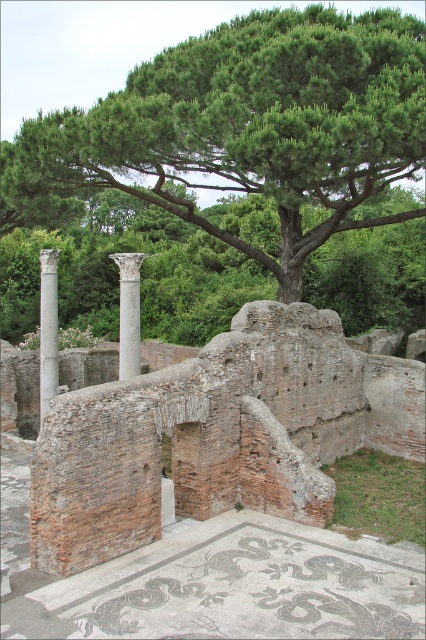
Is brick wall at center taller than white marble column at center?

Yes, brick wall at center is taller than white marble column at center.

In the scene shown: Which is more to the right, brick wall at center or white marble column at center?

brick wall at center

The width and height of the screenshot is (426, 640). What do you see at coordinates (218, 435) in the screenshot? I see `brick wall at center` at bounding box center [218, 435].

Where is `brick wall at center`? The height and width of the screenshot is (640, 426). brick wall at center is located at coordinates (218, 435).

Can you confirm if brick wall at center is bigger than white marble column at left?

No, brick wall at center is not bigger than white marble column at left.

Does brick wall at center have a greater height compared to white marble column at left?

No, brick wall at center is not taller than white marble column at left.

At what (x,y) coordinates should I click in order to perform the action: click on brick wall at center. Please return your answer as a coordinate pair (x, y). This screenshot has width=426, height=640. Looking at the image, I should click on click(218, 435).

The width and height of the screenshot is (426, 640). In order to click on green leafy tree at upper center in this screenshot , I will do `click(244, 132)`.

Does green leafy tree at upper center lie behind brick wall at center?

Yes, green leafy tree at upper center is behind brick wall at center.

At what (x,y) coordinates should I click in order to perform the action: click on green leafy tree at upper center. Please return your answer as a coordinate pair (x, y). The width and height of the screenshot is (426, 640). Looking at the image, I should click on (244, 132).